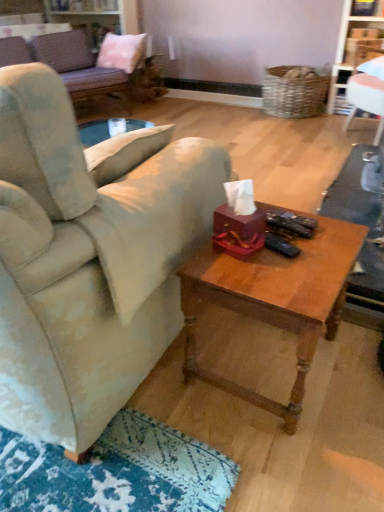
Question: Is velvet beige couch at center, positioned as the 2th studio couch in back-to-front order, looking in the opposite direction of pink fabric pillow at upper left?

Choices:
 (A) no
 (B) yes

Answer: (A)

Question: From the image's perspective, is velvet beige couch at center, positioned as the 2th studio couch in back-to-front order, located above pink fabric pillow at upper left?

Choices:
 (A) no
 (B) yes

Answer: (A)

Question: Is velvet beige couch at center, which is the 1th studio couch in bottom-to-top order, shorter than pink fabric pillow at upper left?

Choices:
 (A) yes
 (B) no

Answer: (B)

Question: Are velvet beige couch at center, which is counted as the first studio couch, starting from the front, and pink fabric pillow at upper left far apart?

Choices:
 (A) no
 (B) yes

Answer: (B)

Question: Does velvet beige couch at center, which is the 1th studio couch in bottom-to-top order, come behind pink fabric pillow at upper left?

Choices:
 (A) yes
 (B) no

Answer: (B)

Question: From a real-world perspective, is velvet beige couch at center, which is counted as the first studio couch, starting from the front, over pink fabric pillow at upper left?

Choices:
 (A) no
 (B) yes

Answer: (A)

Question: Considering the relative positions of wooden coffee table at center and white glossy bookshelf at upper right in the image provided, is wooden coffee table at center in front of white glossy bookshelf at upper right?

Choices:
 (A) yes
 (B) no

Answer: (A)

Question: From the image's perspective, is wooden coffee table at center on white glossy bookshelf at upper right?

Choices:
 (A) no
 (B) yes

Answer: (A)

Question: Is white glossy bookshelf at upper right at the back of wooden coffee table at center?

Choices:
 (A) yes
 (B) no

Answer: (B)

Question: Considering the relative positions of wooden coffee table at center and white glossy bookshelf at upper right in the image provided, is wooden coffee table at center to the left of white glossy bookshelf at upper right from the viewer's perspective?

Choices:
 (A) yes
 (B) no

Answer: (A)

Question: Is wooden coffee table at center not near white glossy bookshelf at upper right?

Choices:
 (A) no
 (B) yes

Answer: (B)

Question: Are wooden coffee table at center and white glossy bookshelf at upper right beside each other?

Choices:
 (A) yes
 (B) no

Answer: (B)

Question: Is white glossy bookshelf at upper right bigger than velvet beige couch at center, the second studio couch when ordered from top to bottom?

Choices:
 (A) yes
 (B) no

Answer: (B)